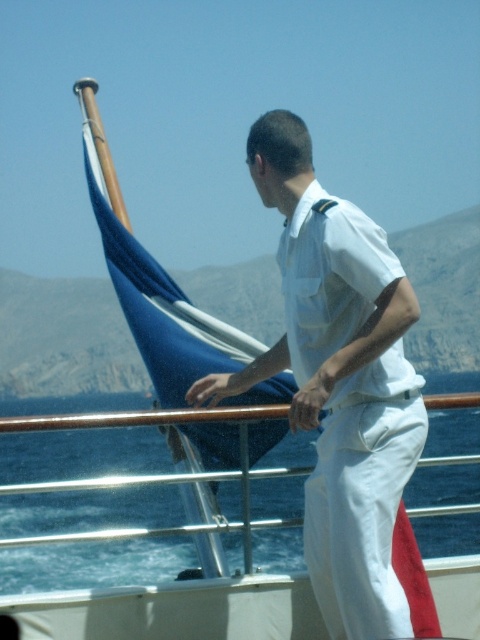
Which is in front, point (356, 244) or point (303, 419)?

Positioned in front is point (303, 419).

Consider the image. Who is shorter, white cotton shirt at center or matte white hand at center?

Standing shorter between the two is matte white hand at center.

Describe the element at coordinates (368, 502) in the screenshot. This screenshot has width=480, height=640. I see `white cotton shirt at center` at that location.

At what (x,y) coordinates should I click in order to perform the action: click on white cotton shirt at center. Please return your answer as a coordinate pair (x, y). Looking at the image, I should click on (368, 502).

Who is more forward, (321, 397) or (189, 392)?

Positioned in front is point (321, 397).

Is point (319, 394) in front of point (212, 384)?

Yes, point (319, 394) is closer to viewer.

Which is in front, point (321, 388) or point (188, 397)?

Point (321, 388) is in front.

Image resolution: width=480 pixels, height=640 pixels. In order to click on matte white hand at center in this screenshot , I will do `click(310, 401)`.

Does point (340, 260) come farther from viewer compared to point (203, 401)?

That is False.

Is white cotton shirt at center positioned behind white matte hand at center?

No, it is not.

I want to click on white cotton shirt at center, so click(x=368, y=502).